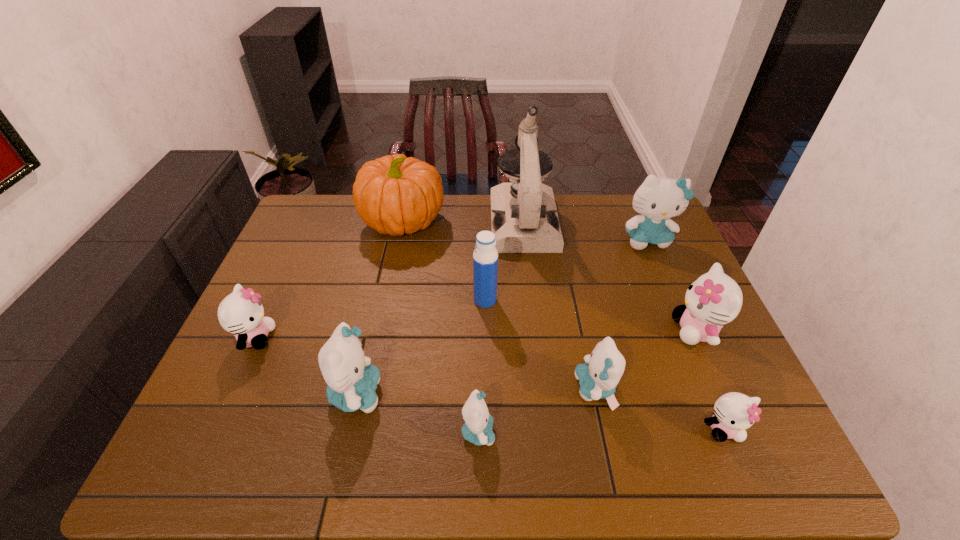
Where is `microscope`? microscope is located at coordinates (524, 218).

Identify the location of pumpkin. (394, 194).

The image size is (960, 540). I want to click on the tallest kitten, so click(658, 199).

I want to click on the farthest kitten, so click(x=658, y=199).

Where is `water bottle`? The image size is (960, 540). water bottle is located at coordinates (485, 256).

Locate an element on the screen. This screenshot has width=960, height=540. the leftmost blue kitten is located at coordinates (351, 380).

In order to click on the sixth kitten from right to left in this screenshot , I will do `click(351, 380)`.

You are a GUI agent. You are given a task and a screenshot of the screen. Output one action in this format:
    pyautogui.click(x=<x>, y=<y>)
    Task: Click on the biggest white kitten
    This screenshot has height=540, width=960.
    Given the screenshot: What is the action you would take?
    pyautogui.click(x=714, y=299)

The height and width of the screenshot is (540, 960). I want to click on the fourth kitten from left to right, so click(598, 378).

The width and height of the screenshot is (960, 540). Find the location of `the second smallest blue kitten`. the second smallest blue kitten is located at coordinates (598, 378).